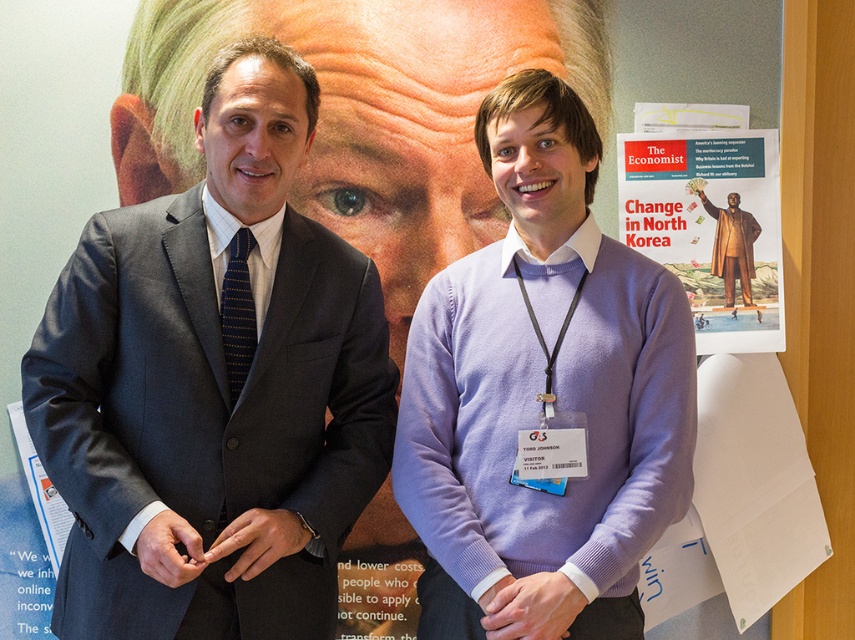
Question: Is matte black suit at left to the left of blue striped tie at left from the viewer's perspective?

Choices:
 (A) yes
 (B) no

Answer: (B)

Question: Based on their relative distances, which object is nearer to the blue striped tie at left?

Choices:
 (A) gold metallic statue at center
 (B) dark gray wool suit at left
 (C) purple sweater at center
 (D) matte paper poster at upper right

Answer: (B)

Question: Is blue striped tie at left bigger than gold metallic statue at center?

Choices:
 (A) yes
 (B) no

Answer: (B)

Question: Which object is farther from the camera taking this photo?

Choices:
 (A) matte black suit at left
 (B) purple sweater at center

Answer: (A)

Question: Which point is closer to the camera taking this photo?

Choices:
 (A) (329, 109)
 (B) (228, 392)

Answer: (B)

Question: Can you confirm if dark gray wool suit at left is smaller than blue striped tie at left?

Choices:
 (A) yes
 (B) no

Answer: (B)